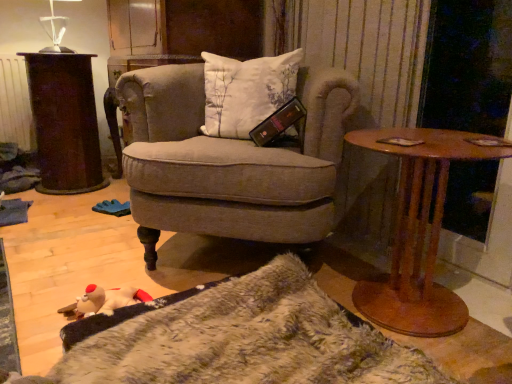
Question: Does transparent glass table lamp at upper left lie behind rusty metal trash can at left?

Choices:
 (A) no
 (B) yes

Answer: (A)

Question: Is transparent glass table lamp at upper left beside rusty metal trash can at left?

Choices:
 (A) yes
 (B) no

Answer: (B)

Question: Is transparent glass table lamp at upper left positioned in front of rusty metal trash can at left?

Choices:
 (A) no
 (B) yes

Answer: (B)

Question: Can you confirm if transparent glass table lamp at upper left is taller than rusty metal trash can at left?

Choices:
 (A) yes
 (B) no

Answer: (B)

Question: From the image's perspective, does transparent glass table lamp at upper left appear lower than rusty metal trash can at left?

Choices:
 (A) no
 (B) yes

Answer: (A)

Question: Does transparent glass table lamp at upper left appear on the left side of rusty metal trash can at left?

Choices:
 (A) yes
 (B) no

Answer: (B)

Question: Is transparent glass table lamp at upper left to the right of brown wooden table at right from the viewer's perspective?

Choices:
 (A) yes
 (B) no

Answer: (B)

Question: Is transparent glass table lamp at upper left shorter than brown wooden table at right?

Choices:
 (A) yes
 (B) no

Answer: (A)

Question: Can you confirm if transparent glass table lamp at upper left is bigger than brown wooden table at right?

Choices:
 (A) yes
 (B) no

Answer: (B)

Question: From the image's perspective, is transparent glass table lamp at upper left on top of brown wooden table at right?

Choices:
 (A) yes
 (B) no

Answer: (A)

Question: Is transparent glass table lamp at upper left wider than brown wooden table at right?

Choices:
 (A) no
 (B) yes

Answer: (A)

Question: Does transparent glass table lamp at upper left come in front of brown wooden table at right?

Choices:
 (A) yes
 (B) no

Answer: (B)

Question: Is brown wooden table at right positioned with its back to rusty metal trash can at left?

Choices:
 (A) no
 (B) yes

Answer: (A)